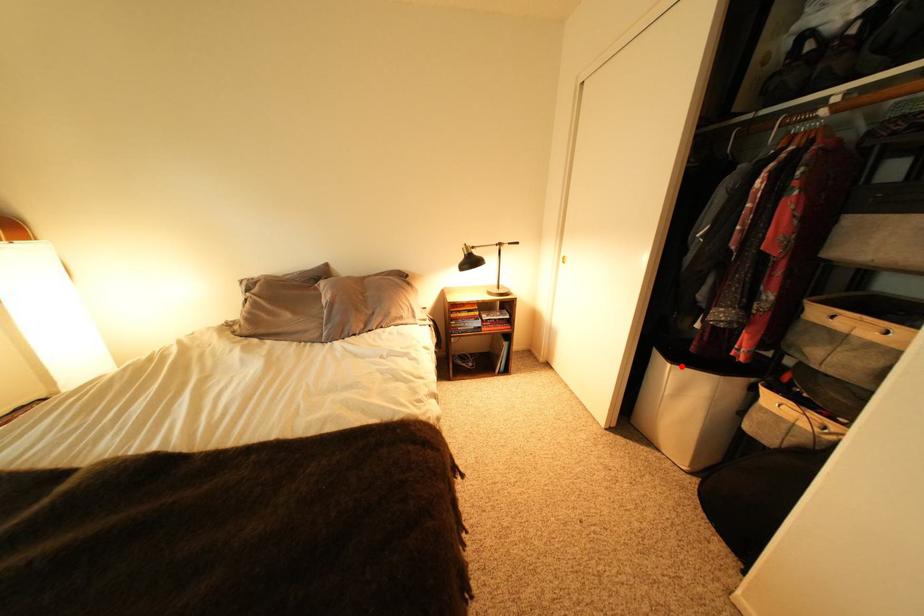
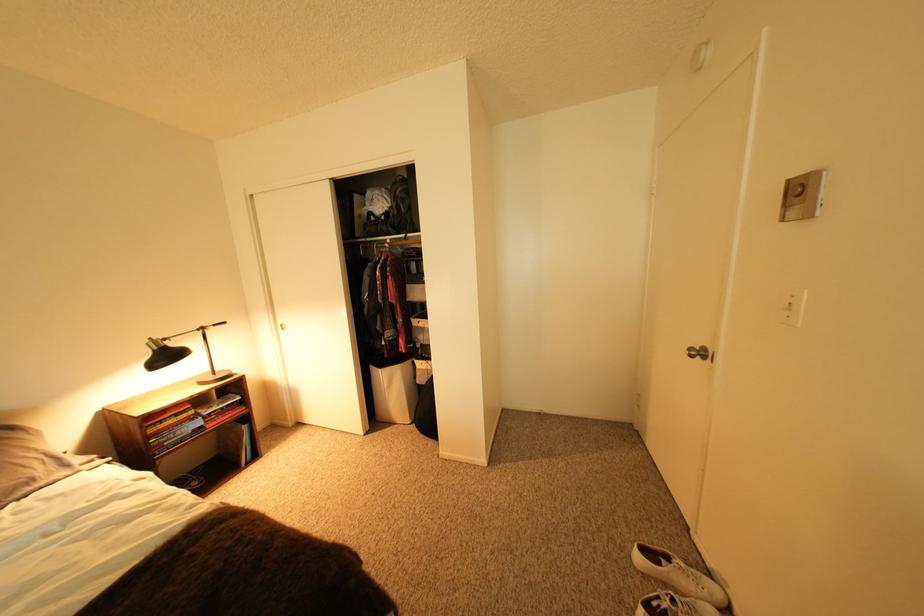
Where in the second image is the point corresponding to the highlighted location from the first image?

(393, 371)